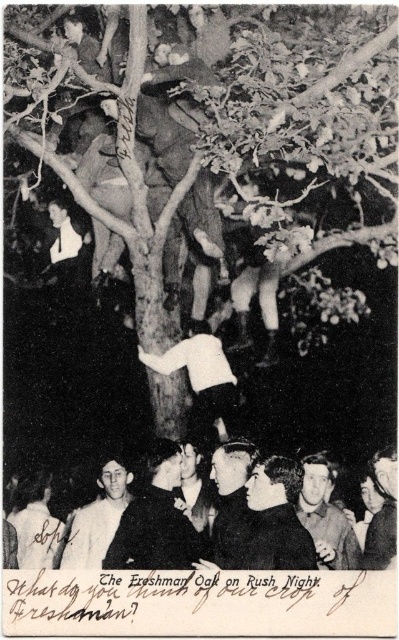
You are at a gathering under a large tree and see both the rough bark tree at center and the smooth leather jacket at center. From your perspective, which object is positioned to the right?

The rough bark tree at center is to the right of the smooth leather jacket at center.